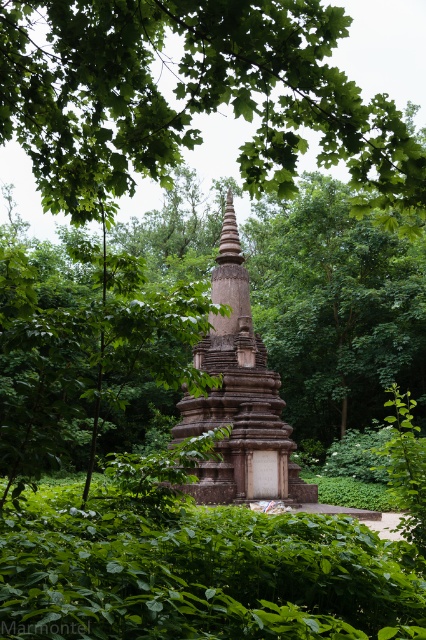
Question: Which point appears farthest from the camera in this image?

Choices:
 (A) (284, 480)
 (B) (58, 176)

Answer: (A)

Question: Does green leafy tree at center appear on the right side of brown stone tower at center?

Choices:
 (A) no
 (B) yes

Answer: (A)

Question: Does green leafy tree at center have a larger size compared to brown stone tower at center?

Choices:
 (A) no
 (B) yes

Answer: (B)

Question: Which point appears closest to the camera in this image?

Choices:
 (A) (291, 468)
 (B) (120, 140)

Answer: (B)

Question: Is green leafy tree at center positioned before brown stone tower at center?

Choices:
 (A) yes
 (B) no

Answer: (A)